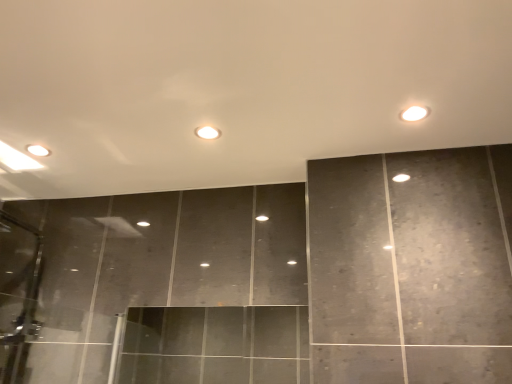
The height and width of the screenshot is (384, 512). What do you see at coordinates (207, 132) in the screenshot?
I see `white glossy light at center, acting as the 2th light starting from the front` at bounding box center [207, 132].

Locate an element on the screen. white glossy light at center, placed as the first light when sorted from back to front is located at coordinates (207, 132).

Image resolution: width=512 pixels, height=384 pixels. What do you see at coordinates (414, 113) in the screenshot?
I see `white glossy light at upper right, which is the first light from right to left` at bounding box center [414, 113].

You are a GUI agent. You are given a task and a screenshot of the screen. Output one action in this format:
    pyautogui.click(x=<x>, y=<y>)
    Task: Click on the white glossy light at upper right, which is the second light in back-to-front order
    
    Given the screenshot: What is the action you would take?
    pyautogui.click(x=414, y=113)

Find the location of `white glossy light at center, placed as the first light when sorted from back to front`. white glossy light at center, placed as the first light when sorted from back to front is located at coordinates (207, 132).

Considering the positions of objects white glossy light at upper right, which is counted as the 2th light, starting from the left, and white glossy light at center, which is counted as the 1th light, starting from the left, in the image provided, who is more to the left, white glossy light at upper right, which is counted as the 2th light, starting from the left, or white glossy light at center, which is counted as the 1th light, starting from the left,?

Positioned to the left is white glossy light at center, which is counted as the 1th light, starting from the left.

Based on the photo, does white glossy light at upper right, which is counted as the 2th light, starting from the left, come in front of white glossy light at center, which is counted as the 1th light, starting from the left?

That is True.

Is point (414, 109) positioned before point (200, 136)?

Yes, point (414, 109) is in front of point (200, 136).

From the image's perspective, which one is positioned higher, white glossy light at upper right, which is the second light in back-to-front order, or white glossy light at center, marked as the 2th light in a right-to-left arrangement?

From the image's view, white glossy light at upper right, which is the second light in back-to-front order, is above.

From a real-world perspective, is white glossy light at upper right, which is the second light in back-to-front order, positioned above or below white glossy light at center, which is counted as the 1th light, starting from the left?

In terms of real-world spatial position, white glossy light at upper right, which is the second light in back-to-front order, is below white glossy light at center, which is counted as the 1th light, starting from the left.

From the picture: Is white glossy light at upper right, which is counted as the first light, starting from the front, thinner than white glossy light at center, acting as the 2th light starting from the front?

Yes.

Considering the sizes of objects white glossy light at upper right, which is the first light from right to left, and white glossy light at center, which is counted as the 1th light, starting from the left, in the image provided, who is taller, white glossy light at upper right, which is the first light from right to left, or white glossy light at center, which is counted as the 1th light, starting from the left,?

With more height is white glossy light at upper right, which is the first light from right to left.

Considering the sizes of white glossy light at upper right, which is the first light from right to left, and white glossy light at center, placed as the first light when sorted from back to front, in the image, is white glossy light at upper right, which is the first light from right to left, bigger or smaller than white glossy light at center, placed as the first light when sorted from back to front,?

white glossy light at upper right, which is the first light from right to left, is bigger than white glossy light at center, placed as the first light when sorted from back to front.

Is white glossy light at center, placed as the first light when sorted from back to front, a part of white glossy light at upper right, which is the first light from right to left?

No, white glossy light at center, placed as the first light when sorted from back to front, is located outside of white glossy light at upper right, which is the first light from right to left.

Is white glossy light at upper right, which is the first light from right to left, next to white glossy light at center, which is counted as the 1th light, starting from the left?

No, white glossy light at upper right, which is the first light from right to left, is not making contact with white glossy light at center, which is counted as the 1th light, starting from the left.

Is white glossy light at upper right, which is counted as the 2th light, starting from the left, aimed at white glossy light at center, placed as the first light when sorted from back to front?

No, white glossy light at upper right, which is counted as the 2th light, starting from the left, is not facing towards white glossy light at center, placed as the first light when sorted from back to front.

How distant is white glossy light at upper right, which is the first light from right to left, from white glossy light at center, marked as the 2th light in a right-to-left arrangement?

21.85 inches.

The height and width of the screenshot is (384, 512). I want to click on light behind the white glossy light at upper right, which is counted as the first light, starting from the front, so click(207, 132).

Looking at this image, is white glossy light at center, placed as the first light when sorted from back to front, at the right side of white glossy light at upper right, which is the second light in back-to-front order?

No, white glossy light at center, placed as the first light when sorted from back to front, is not to the right of white glossy light at upper right, which is the second light in back-to-front order.

Is white glossy light at center, acting as the 2th light starting from the front, in front of or behind white glossy light at upper right, which is counted as the 2th light, starting from the left, in the image?

In the image, white glossy light at center, acting as the 2th light starting from the front, appears behind white glossy light at upper right, which is counted as the 2th light, starting from the left.

Which point is more distant from viewer, (205, 128) or (418, 118)?

Point (205, 128)

From the image's perspective, is white glossy light at center, which is counted as the 1th light, starting from the left, on top of white glossy light at upper right, which is the second light in back-to-front order?

No, from the image's perspective, white glossy light at center, which is counted as the 1th light, starting from the left, is not above white glossy light at upper right, which is the second light in back-to-front order.

From a real-world perspective, does white glossy light at center, which is counted as the 1th light, starting from the left, sit lower than white glossy light at upper right, which is counted as the 2th light, starting from the left?

No.

Considering the relative sizes of white glossy light at center, placed as the first light when sorted from back to front, and white glossy light at upper right, which is counted as the first light, starting from the front, in the image provided, is white glossy light at center, placed as the first light when sorted from back to front, thinner than white glossy light at upper right, which is counted as the first light, starting from the front,?

Incorrect, the width of white glossy light at center, placed as the first light when sorted from back to front, is not less than that of white glossy light at upper right, which is counted as the first light, starting from the front.

Is white glossy light at center, placed as the first light when sorted from back to front, shorter than white glossy light at upper right, which is counted as the 2th light, starting from the left?

Indeed, white glossy light at center, placed as the first light when sorted from back to front, has a lesser height compared to white glossy light at upper right, which is counted as the 2th light, starting from the left.

Is white glossy light at center, placed as the first light when sorted from back to front, smaller than white glossy light at upper right, which is the first light from right to left?

Yes, white glossy light at center, placed as the first light when sorted from back to front, is smaller than white glossy light at upper right, which is the first light from right to left.

Is white glossy light at center, which is counted as the 1th light, starting from the left, surrounding white glossy light at upper right, which is counted as the first light, starting from the front?

Actually, white glossy light at upper right, which is counted as the first light, starting from the front, is outside white glossy light at center, which is counted as the 1th light, starting from the left.

Are white glossy light at center, which is counted as the 1th light, starting from the left, and white glossy light at upper right, which is the first light from right to left, making contact?

No, white glossy light at center, which is counted as the 1th light, starting from the left, is not next to white glossy light at upper right, which is the first light from right to left.

Is white glossy light at center, which is counted as the 1th light, starting from the left, oriented towards white glossy light at upper right, which is the first light from right to left?

No, white glossy light at center, which is counted as the 1th light, starting from the left, is not oriented towards white glossy light at upper right, which is the first light from right to left.

How different are the orientations of white glossy light at center, acting as the 2th light starting from the front, and white glossy light at upper right, which is the second light in back-to-front order, in degrees?

white glossy light at center, acting as the 2th light starting from the front, and white glossy light at upper right, which is the second light in back-to-front order, are facing 0.463 degrees away from each other.

Where is `light behind the white glossy light at upper right, which is the first light from right to left`? The height and width of the screenshot is (384, 512). light behind the white glossy light at upper right, which is the first light from right to left is located at coordinates (207, 132).

Locate an element on the screen. This screenshot has height=384, width=512. light behind the white glossy light at upper right, which is counted as the first light, starting from the front is located at coordinates (207, 132).

At what (x,y) coordinates should I click in order to perform the action: click on light below the white glossy light at upper right, which is counted as the 2th light, starting from the left (from the image's perspective). Please return your answer as a coordinate pair (x, y). Image resolution: width=512 pixels, height=384 pixels. Looking at the image, I should click on (207, 132).